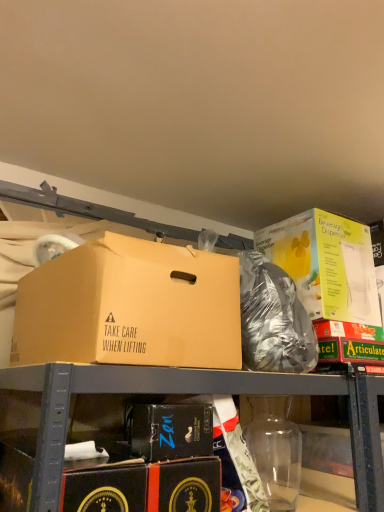
Question: Is matte cardboard box at upper left, which appears as the 3th box when viewed from the right, taller or shorter than yellow cardboard beverage dispenser at upper right, the 3th box from the left?

Choices:
 (A) short
 (B) tall

Answer: (A)

Question: In the image, is matte cardboard box at upper left, which appears as the 3th box when viewed from the right, positioned in front of or behind yellow cardboard beverage dispenser at upper right, the 3th box from the left?

Choices:
 (A) behind
 (B) front

Answer: (B)

Question: Which object is positioned closest to the matte cardboard box at upper left, which appears as the 3th box when viewed from the right?

Choices:
 (A) black cardboard box at lower center, placed as the 2th box when sorted from right to left
 (B) yellow cardboard beverage dispenser at upper right, which is the 1th box from right to left
 (C) transparent plastic bottle at lower center

Answer: (A)

Question: Estimate the real-world distances between objects in this image. Which object is closer to the matte cardboard box at upper left, placed as the 1th box when sorted from left to right?

Choices:
 (A) yellow cardboard beverage dispenser at upper right, which is the 1th box from right to left
 (B) black cardboard box at lower center, which is counted as the 2th box, starting from the left
 (C) transparent plastic bottle at lower center

Answer: (B)